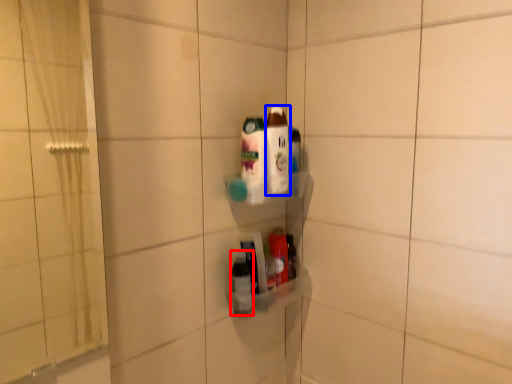
Question: Which of the following is the closest to the observer, bottle (highlighted by a red box) or bottle (highlighted by a blue box)?

Choices:
 (A) bottle
 (B) bottle

Answer: (B)